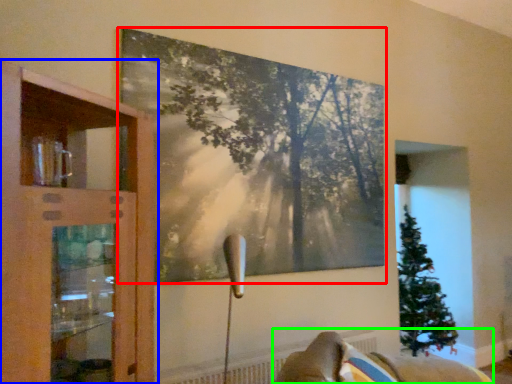
Question: Considering the real-world distances, which object is farthest from picture frame (highlighted by a red box)? cupboard (highlighted by a blue box) or furniture (highlighted by a green box)?

Choices:
 (A) cupboard
 (B) furniture

Answer: (B)